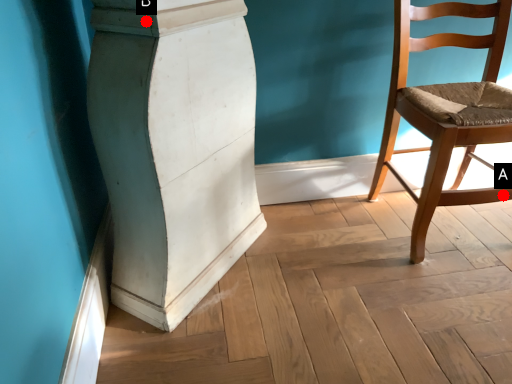
Question: Two points are circled on the image, labeled by A and B beside each circle. Which point is farther to the camera?

Choices:
 (A) A is further
 (B) B is further

Answer: (A)